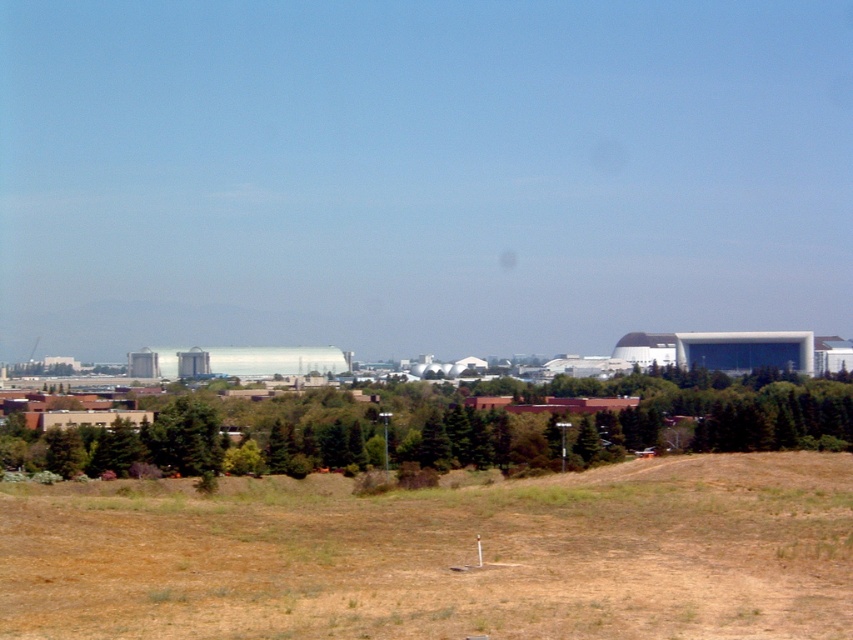
Question: Can you confirm if brown grass at lower center is positioned to the left of green leafy tree at lower center?

Choices:
 (A) no
 (B) yes

Answer: (A)

Question: Which point is closer to the camera?

Choices:
 (A) (189, 541)
 (B) (318, 464)

Answer: (A)

Question: Can you confirm if brown grass at lower center is positioned above green leafy tree at lower center?

Choices:
 (A) no
 (B) yes

Answer: (B)

Question: Is brown grass at lower center below green leafy tree at lower center?

Choices:
 (A) yes
 (B) no

Answer: (B)

Question: Among these points, which one is farthest from the camera?

Choices:
 (A) (102, 442)
 (B) (653, 584)

Answer: (A)